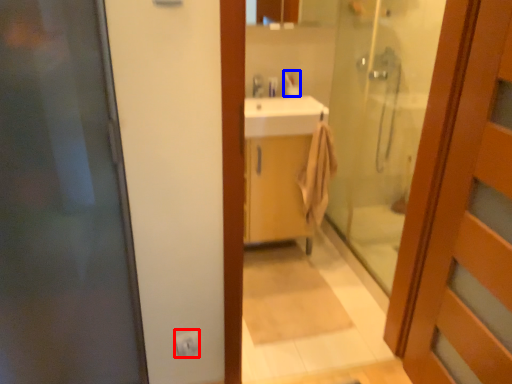
Question: Which object appears farthest to the camera in this image, electric outlet (highlighted by a red box) or toiletry (highlighted by a blue box)?

Choices:
 (A) electric outlet
 (B) toiletry

Answer: (B)